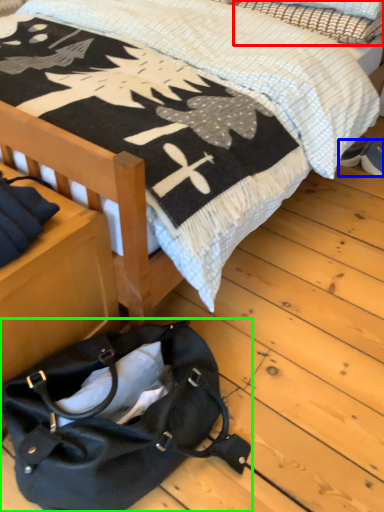
Question: Considering the real-world distances, which object is closest to pillow (highlighted by a red box)? footwear (highlighted by a blue box) or handbag (highlighted by a green box).

Choices:
 (A) footwear
 (B) handbag

Answer: (A)